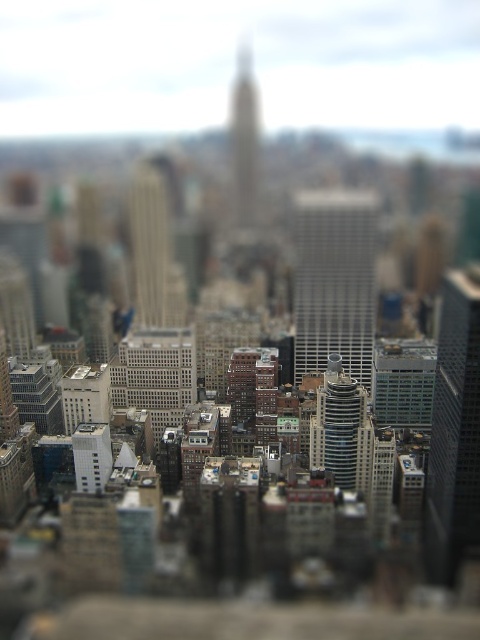
You are a drone operator tasked with flying a drone between the silver metallic skyscraper at center and the glassy skyscraper at right. The drone has a maximum flight distance of 400 feet. Can you safely fly the drone between these two skyscrapers without exceeding its range?

The silver metallic skyscraper at center is 386.45 feet away from the glassy skyscraper at right. Since the drone has a maximum flight distance of 400 feet, it can safely fly between them as the distance is within the drone

You are a drone operator tasked with capturing aerial footage of the city. Your drone is currently hovering at point 0.5 on the x and y coordinates. You need to adjust its position to focus on the shiny silver skyscraper at center. In which direction should you move the drone to reach the skyscraper?

The shiny silver skyscraper at center is located at point 0.672 on the x and 0.713 on the y coordinates. Since the drone is at 0.5 on both axes, you should move it northeast to reach the skyscraper.

You are a drone operator tasked with capturing aerial footage of the city. Your drone has a maximum flight range of 600 meters. You want to fly from your current position to the silver metallic skyscraper at center. Can your drone reach it without exceeding its range limit?

The distance between the silver metallic skyscraper at center and the camera is 612.89 meters. Since the drone has a maximum range of 600 meters, it cannot reach the skyscraper without exceeding its limit.